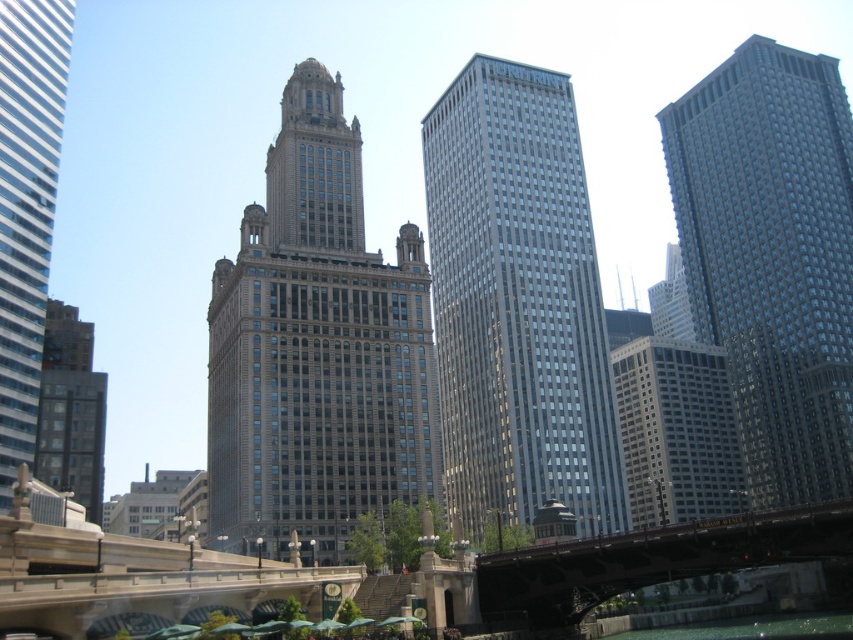
This screenshot has width=853, height=640. Describe the element at coordinates (26, 209) in the screenshot. I see `matte glass skyscraper at left` at that location.

Does matte glass skyscraper at left appear on the right side of dark gray concrete building at lower left?

Yes, matte glass skyscraper at left is to the right of dark gray concrete building at lower left.

Between point (28, 106) and point (82, 371), which one is positioned behind?

The point (82, 371) is behind.

This screenshot has width=853, height=640. I want to click on matte glass skyscraper at left, so coord(26,209).

Can you confirm if glassy steel skyscraper at right is positioned above matte glass skyscraper at left?

Actually, glassy steel skyscraper at right is below matte glass skyscraper at left.

Does glassy steel skyscraper at right have a greater height compared to matte glass skyscraper at left?

Yes.

Does point (695, 202) come in front of point (4, 348)?

No, (695, 202) is further to viewer.

Where is `glassy steel skyscraper at right`? This screenshot has height=640, width=853. glassy steel skyscraper at right is located at coordinates (772, 257).

Can you confirm if glassy steel skyscraper at center is positioned to the left of glassy steel skyscraper at right?

Correct, you'll find glassy steel skyscraper at center to the left of glassy steel skyscraper at right.

Is glassy steel skyscraper at center positioned behind glassy steel skyscraper at right?

No, it is not.

Does point (524, 372) lie behind point (850, 262)?

No.

This screenshot has height=640, width=853. I want to click on glassy steel skyscraper at center, so click(517, 304).